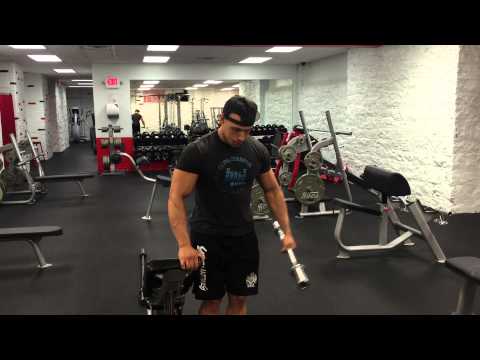
This screenshot has height=360, width=480. In order to click on red door in this screenshot , I will do `click(7, 116)`.